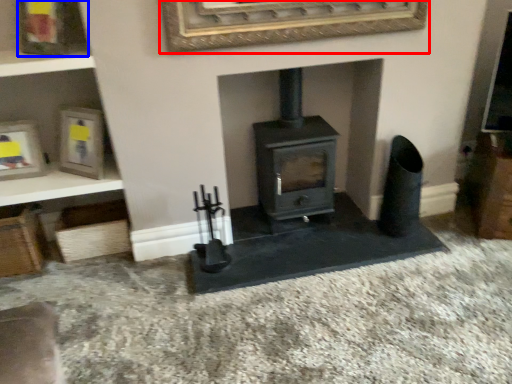
Question: Which point is closer to the camera, picture frame (highlighted by a red box) or picture frame (highlighted by a blue box)?

Choices:
 (A) picture frame
 (B) picture frame

Answer: (A)